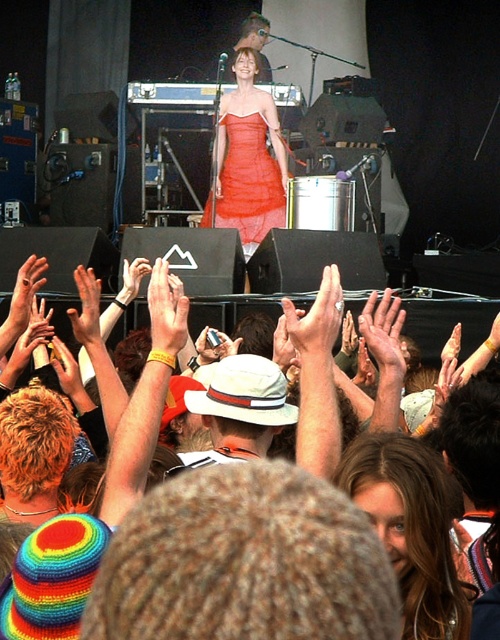
Question: Is matte white hand at center below smooth skin hand at center?

Choices:
 (A) no
 (B) yes

Answer: (B)

Question: Estimate the real-world distances between objects in this image. Which object is farther from the translucent orange dress at center?

Choices:
 (A) smooth skin hand at center
 (B) matte white hand at center
 (C) light brown leather hand at upper center
 (D) blonde hair at center

Answer: (D)

Question: Can you confirm if blonde hair at center is thinner than light brown leather hand at upper center?

Choices:
 (A) no
 (B) yes

Answer: (A)

Question: Among these points, which one is farthest from the camera?

Choices:
 (A) (98, 342)
 (B) (298, 326)
 (C) (222, 125)
 (D) (183, 360)

Answer: (C)

Question: Does translucent orange dress at center appear under matte white hand at center?

Choices:
 (A) yes
 (B) no

Answer: (B)

Question: Based on their relative distances, which object is farther from the smooth skin hand at center?

Choices:
 (A) blonde hair at center
 (B) light brown leather hand at upper center
 (C) matte white hand at center

Answer: (A)